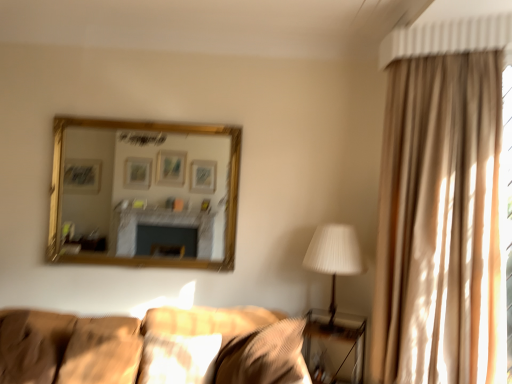
Question: Is textured beige pillow at lower center, acting as the fourth pillow starting from the left, to the left or to the right of gold-framed mirror at upper center in the image?

Choices:
 (A) right
 (B) left

Answer: (A)

Question: In terms of width, does textured beige pillow at lower center, acting as the fourth pillow starting from the left, look wider or thinner when compared to gold-framed mirror at upper center?

Choices:
 (A) wide
 (B) thin

Answer: (A)

Question: Which is farther from the gold-framed mirror at upper center?

Choices:
 (A) soft beige pillow at lower left, which ranks as the second pillow in left-to-right order
 (B) white pleated fabric at right
 (C) metallic silver table at lower right
 (D) matte beige pillow at center, placed as the second pillow when sorted from right to left
 (E) suede-like brown pillow at lower left, arranged as the fourth pillow when viewed from the right

Answer: (D)

Question: Which object is the farthest from the textured beige pillow at lower center, the first pillow in the right-to-left sequence?

Choices:
 (A) suede-like brown pillow at lower left, which is the 1th pillow from left to right
 (B) matte beige pillow at center, placed as the second pillow when sorted from right to left
 (C) metallic silver table at lower right
 (D) soft beige pillow at lower left, which ranks as the second pillow in left-to-right order
 (E) beige fabric curtain at right

Answer: (A)